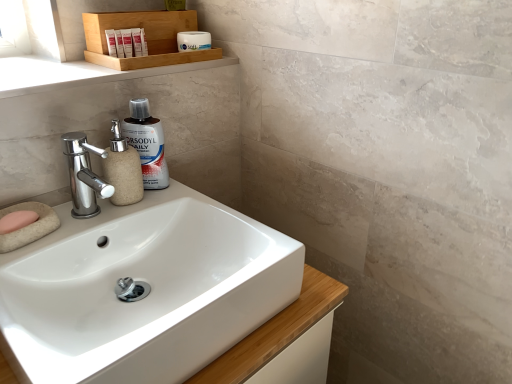
The width and height of the screenshot is (512, 384). What are the coordinates of `vacant area on top of beige marble tray at upper left (from a real-world perspective)` in the screenshot? It's located at (49, 66).